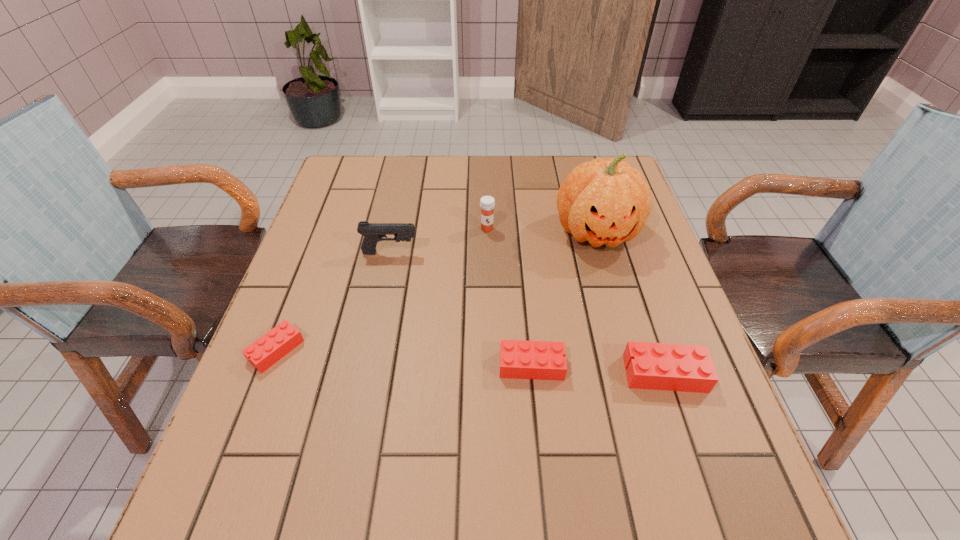
Identify the location of free point that satisfies the following two spatial constraints: 1. at the barrel of the pistol; 2. on the front side of the leftmost object. This screenshot has width=960, height=540. (371, 350).

You are a GUI agent. You are given a task and a screenshot of the screen. Output one action in this format:
    pyautogui.click(x=<x>, y=<y>)
    Task: Click on the vacant region that satisfies the following two spatial constraints: 1. on the front side of the second shortest object; 2. on the right side of the third shortest object
    
    Given the screenshot: What is the action you would take?
    pyautogui.click(x=532, y=374)

Where is `free spot that satisfies the following two spatial constraints: 1. on the back side of the second Lego from left to right; 2. at the barrel of the pistol`? This screenshot has width=960, height=540. free spot that satisfies the following two spatial constraints: 1. on the back side of the second Lego from left to right; 2. at the barrel of the pistol is located at coordinates [520, 253].

In order to click on free space that satisfies the following two spatial constraints: 1. on the carved face of the pumpkin; 2. at the barrel of the pistol in this screenshot , I will do `click(602, 253)`.